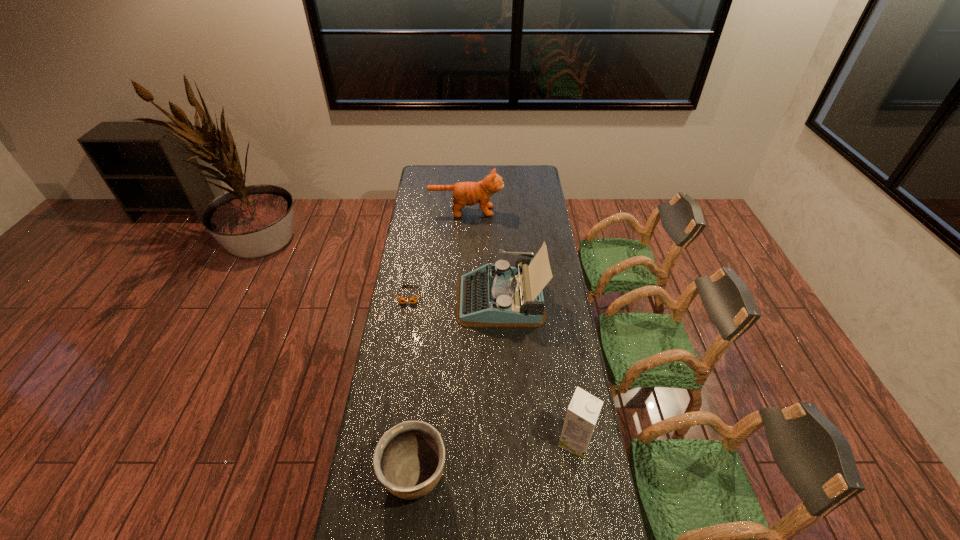
I want to click on the farthest object, so click(x=464, y=193).

You are a GUI agent. You are given a task and a screenshot of the screen. Output one action in this format:
    pyautogui.click(x=<x>, y=<y>)
    Task: Click on the typewriter
    Image resolution: width=960 pixels, height=540 pixels.
    Given the screenshot: What is the action you would take?
    pyautogui.click(x=494, y=295)

The width and height of the screenshot is (960, 540). Find the location of `carton`. carton is located at coordinates (583, 411).

I want to click on the second shortest object, so click(409, 458).

The image size is (960, 540). Find the location of `goggles`. goggles is located at coordinates (401, 299).

Find the location of `free space located on the face of the cat`. free space located on the face of the cat is located at coordinates (526, 211).

At what (x,y) coordinates should I click in order to perform the action: click on free region located 0.190m on the typing side of the typewriter. Please return your answer as a coordinate pair (x, y). Looking at the image, I should click on (415, 299).

Where is `free location located on the typing side of the typewriter`? free location located on the typing side of the typewriter is located at coordinates (426, 299).

Find the location of a particular element. free space located on the typing side of the typewriter is located at coordinates (418, 299).

Where is `blank space located 0.360m on the back of the carton`? blank space located 0.360m on the back of the carton is located at coordinates (559, 343).